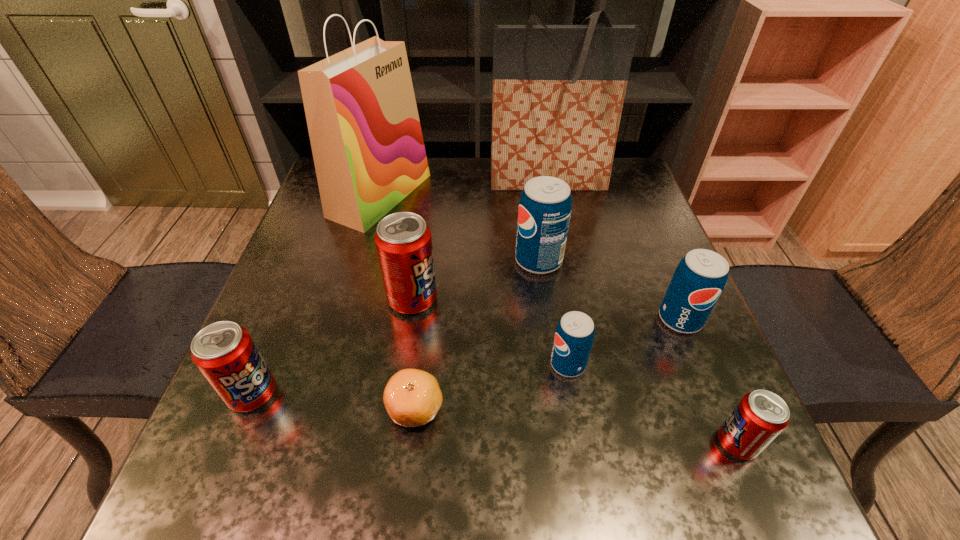
Locate an element on the screen. vacant area situated on the back of the leftmost soda can is located at coordinates (298, 282).

Locate an element on the screen. The height and width of the screenshot is (540, 960). vacant position located on the left of the smallest blue pop is located at coordinates (393, 364).

Where is `vacant space situated on the left of the nearest soda can`? The image size is (960, 540). vacant space situated on the left of the nearest soda can is located at coordinates (655, 443).

You are a GUI agent. You are given a task and a screenshot of the screen. Output one action in this format:
    pyautogui.click(x=<x>, y=<y>)
    Task: Click on the free space located 0.290m on the left of the orange clementine
    The width and height of the screenshot is (960, 540).
    Given the screenshot: What is the action you would take?
    pyautogui.click(x=216, y=408)

Locate an element on the screen. object present at the near edge is located at coordinates (761, 415).

The width and height of the screenshot is (960, 540). In order to click on shopping bag located in the left edge section of the desktop in this screenshot , I will do `click(364, 128)`.

Find the location of `soda can at the left edge`. soda can at the left edge is located at coordinates (224, 352).

You are a GUI agent. You are given a task and a screenshot of the screen. Output one action in this format:
    pyautogui.click(x=<x>, y=<y>)
    Task: Click on the shopping bag at the right edge
    Image resolution: width=960 pixels, height=540 pixels.
    Given the screenshot: What is the action you would take?
    pyautogui.click(x=558, y=91)

Find the location of a particular element. Image resolution: width=960 pixels, height=540 pixels. object present at the far left corner is located at coordinates (364, 128).

At what (x,y) coordinates should I click in order to perform the action: click on object at the far right corner. Please return your answer as a coordinate pair (x, y). The width and height of the screenshot is (960, 540). Looking at the image, I should click on coord(558,91).